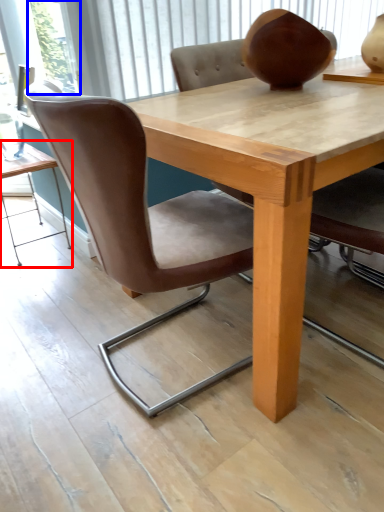
Question: Which point is further to the camera, table (highlighted by a red box) or glass door (highlighted by a blue box)?

Choices:
 (A) table
 (B) glass door

Answer: (A)